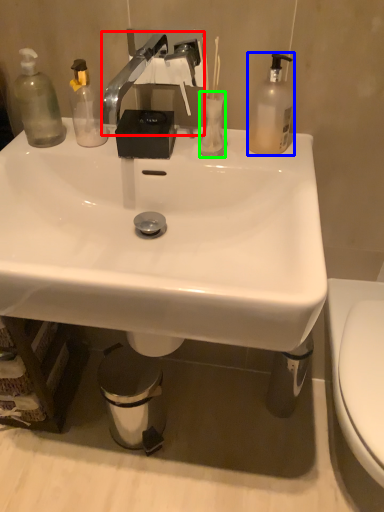
Question: Estimate the real-world distances between objects in this image. Which object is closer to faucet (highlighted by a red box), bottle (highlighted by a blue box) or toilet paper (highlighted by a green box)?

Choices:
 (A) bottle
 (B) toilet paper

Answer: (B)